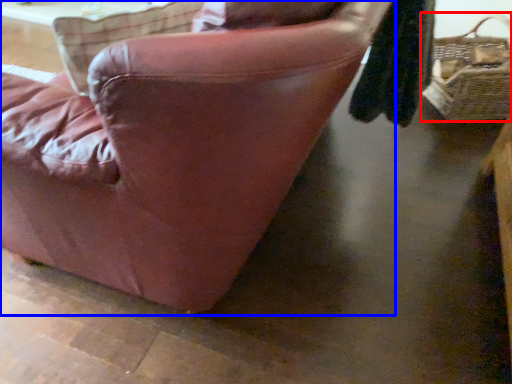
Question: Which object is closer to the camera taking this photo, picnic basket (highlighted by a red box) or chair (highlighted by a blue box)?

Choices:
 (A) picnic basket
 (B) chair

Answer: (B)